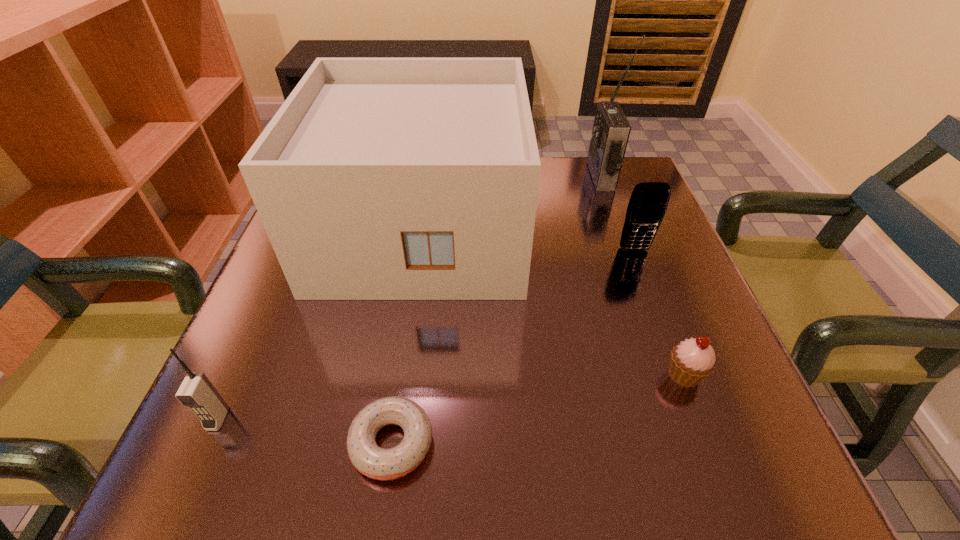
You are a GUI agent. You are given a task and a screenshot of the screen. Output one action in this format:
    pyautogui.click(x=<x>, y=<y>)
    Task: Click on the vacant space at the left edge
    
    Given the screenshot: What is the action you would take?
    pyautogui.click(x=269, y=403)

Where is `vacant space at the right edge`? Image resolution: width=960 pixels, height=540 pixels. vacant space at the right edge is located at coordinates click(x=627, y=272).

In the image, there is a desktop. Where is `vacant area at the near left corner`? This screenshot has width=960, height=540. vacant area at the near left corner is located at coordinates (298, 434).

This screenshot has height=540, width=960. I want to click on vacant space that is in between the radio receiver and the third nearest object, so click(x=642, y=275).

Image resolution: width=960 pixels, height=540 pixels. What are the coordinates of `vacant area that lies between the second shortest object and the right cellular telephone` in the screenshot? It's located at (660, 312).

The width and height of the screenshot is (960, 540). What are the coordinates of `free spot between the radio receiver and the farther cellular telephone` in the screenshot? It's located at (617, 213).

The width and height of the screenshot is (960, 540). I want to click on free space between the box and the fourth farthest object, so click(553, 301).

The image size is (960, 540). I want to click on blank region between the farther cellular telephone and the radio receiver, so click(617, 213).

Find the location of a particular element. unoccupied position between the box and the fifth tallest object is located at coordinates (553, 301).

I want to click on vacant region between the radio receiver and the doughnut, so click(x=496, y=309).